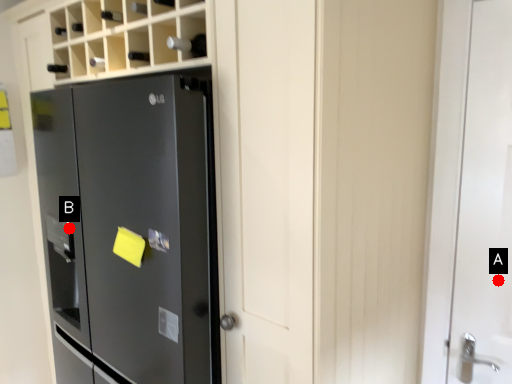
Question: Two points are circled on the image, labeled by A and B beside each circle. Which point is farther from the camera taking this photo?

Choices:
 (A) A is further
 (B) B is further

Answer: (B)